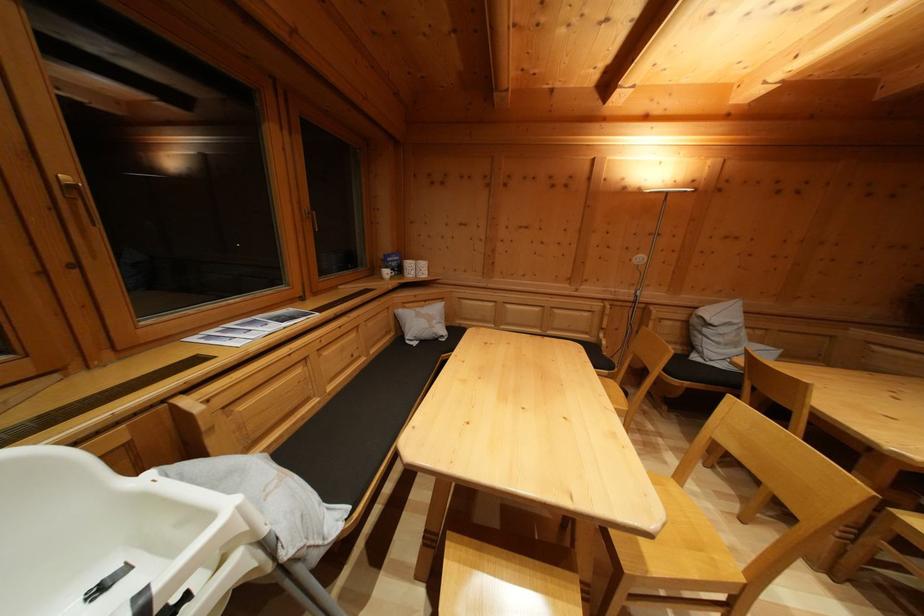
The location [718,333] corresponds to which object?

It refers to a grey chair cushion.